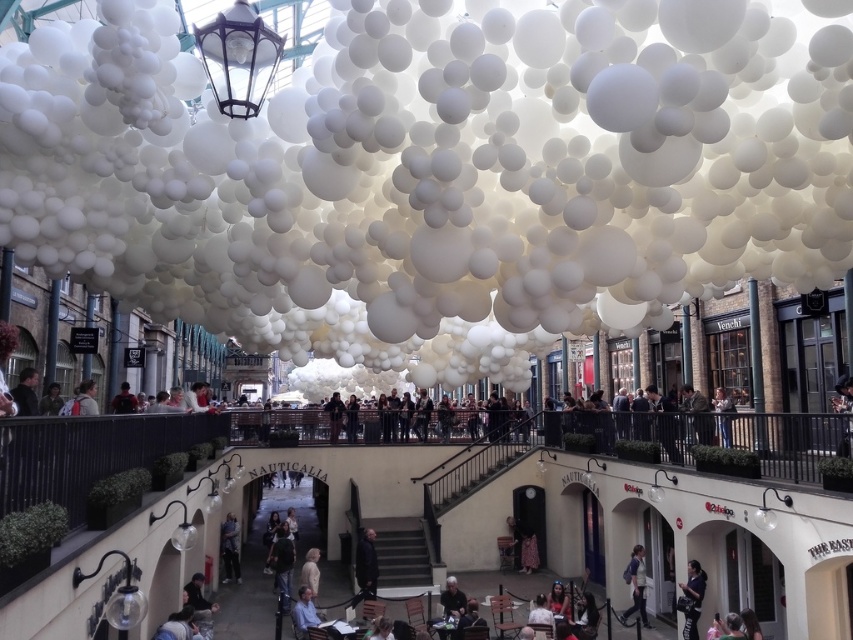
Question: Is dark gray fabric jacket at center positioned in front of black leather jacket at lower right?

Choices:
 (A) yes
 (B) no

Answer: (B)

Question: Considering the real-world distances, which object is closest to the light beige fabric coat at center?

Choices:
 (A) camouflage jacket at lower left
 (B) denim jacket at lower right
 (C) dark gray suit at center

Answer: (C)

Question: Is denim jacket at lower right thinner than camouflage jacket at lower left?

Choices:
 (A) no
 (B) yes

Answer: (B)

Question: Does denim jacket at lower right lie in front of light beige fabric coat at center?

Choices:
 (A) yes
 (B) no

Answer: (B)

Question: Among these objects, which one is nearest to the camera?

Choices:
 (A) camouflage jacket at lower left
 (B) light brown leather jacket at lower left
 (C) dark gray fabric jacket at center

Answer: (B)

Question: Which is farther from the dark gray fabric jacket at center?

Choices:
 (A) dark gray suit at center
 (B) denim jacket at lower right
 (C) light brown leather jacket at lower left
 (D) matte black jacket at center

Answer: (B)